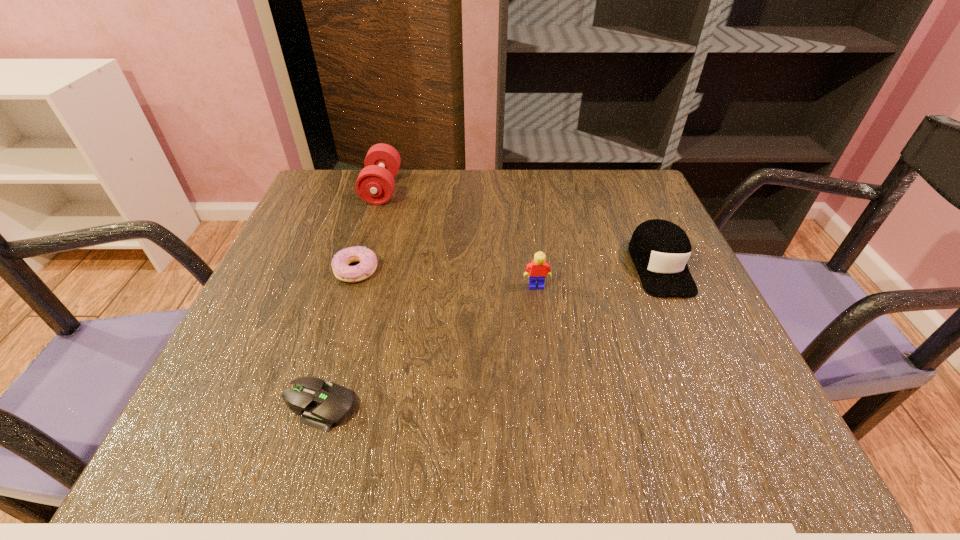
Where is `vacant area at the near edge`? Image resolution: width=960 pixels, height=540 pixels. vacant area at the near edge is located at coordinates (549, 423).

Where is `vacant area at the left edge`? This screenshot has width=960, height=540. vacant area at the left edge is located at coordinates (337, 246).

In the image, there is a desktop. Where is `vacant space at the far left corner`? vacant space at the far left corner is located at coordinates (343, 180).

In the image, there is a desktop. Identify the location of vacant space at the far right corner. The image size is (960, 540). (649, 218).

The width and height of the screenshot is (960, 540). Find the location of `free spot between the dumbbell and the second shortest object`. free spot between the dumbbell and the second shortest object is located at coordinates (369, 230).

Locate an element on the screen. This screenshot has width=960, height=540. unoccupied position between the second shortest object and the shortest object is located at coordinates (338, 338).

Where is `vacant space that is in between the second shortest object and the rightmost object`? vacant space that is in between the second shortest object and the rightmost object is located at coordinates (508, 268).

At what (x,y) coordinates should I click in order to perform the action: click on vacant point located between the second shortest object and the cap. Please return your answer as a coordinate pair (x, y). Looking at the image, I should click on (508, 268).

In order to click on vacant region between the rightmost object and the nearest object in this screenshot , I will do [x=490, y=336].

Locate an element on the screen. This screenshot has height=540, width=960. vacant space in between the doughnut and the rightmost object is located at coordinates (508, 268).